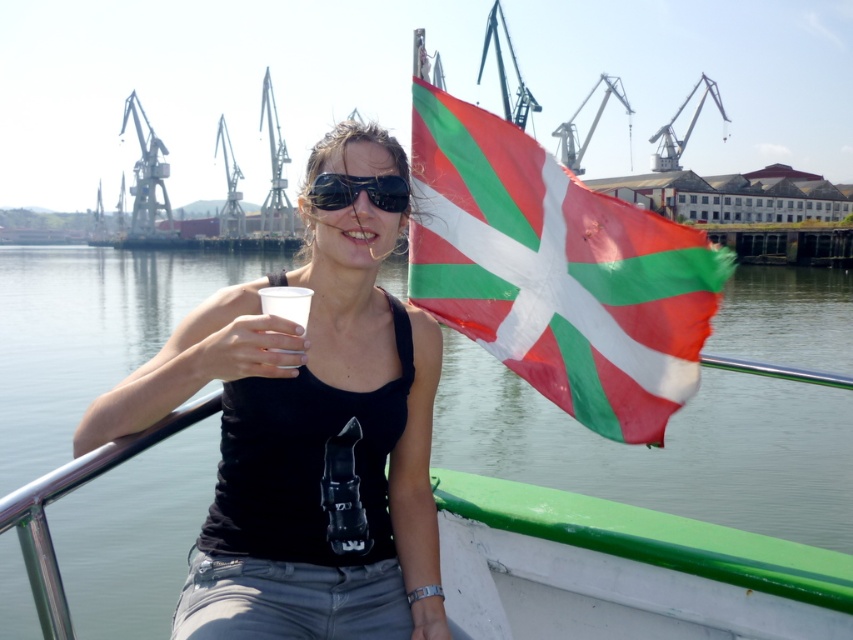
Question: Among these points, which one is nearest to the camera?

Choices:
 (A) pos(22,396)
 (B) pos(282,288)

Answer: (B)

Question: Which point is closer to the camera?

Choices:
 (A) black matte tank top at center
 (B) transparent plastic cup at upper center
 (C) sunglasses at center

Answer: (B)

Question: Which object is positioned farthest from the sunglasses at center?

Choices:
 (A) black matte tank top at center
 (B) red-green fabric flag at center
 (C) transparent plastic cup at upper center
 (D) clear plastic cup at center

Answer: (C)

Question: Considering the relative positions of transparent plastic cup at upper center and clear plastic cup at center in the image provided, where is transparent plastic cup at upper center located with respect to clear plastic cup at center?

Choices:
 (A) right
 (B) left

Answer: (A)

Question: Is black matte tank top at center positioned before clear plastic cup at center?

Choices:
 (A) yes
 (B) no

Answer: (A)

Question: Can you confirm if transparent plastic cup at upper center is positioned above sunglasses at center?

Choices:
 (A) yes
 (B) no

Answer: (A)